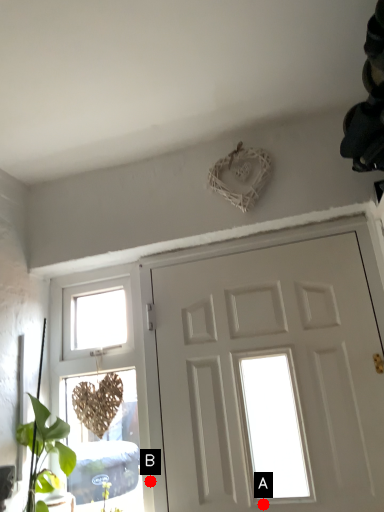
Question: Two points are circled on the image, labeled by A and B beside each circle. Which point is closer to the camera taking this photo?

Choices:
 (A) A is closer
 (B) B is closer

Answer: (A)